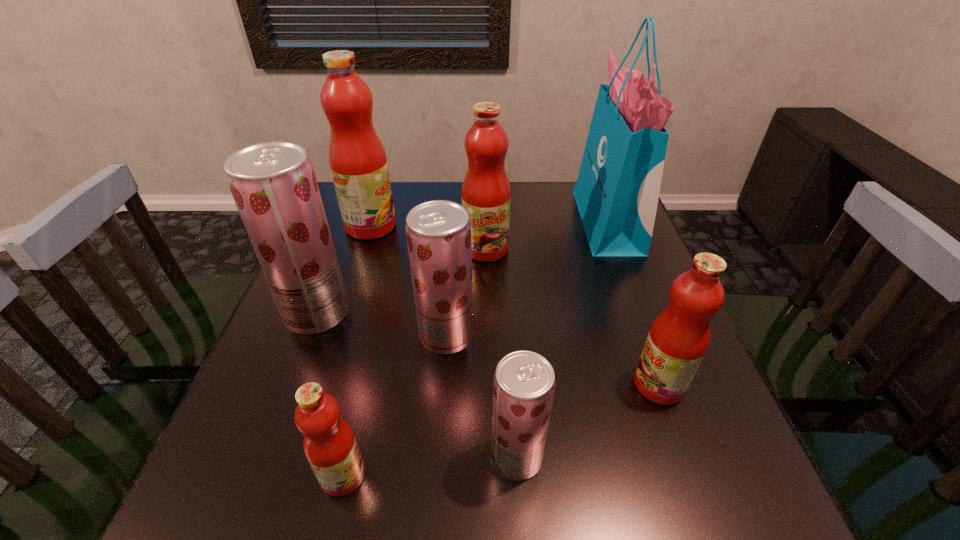
Locate an element on the screen. The width and height of the screenshot is (960, 540). vacant point located between the smallest strawberry fruit juice and the smallest pink fruit juice is located at coordinates (430, 466).

You are a GUI agent. You are given a task and a screenshot of the screen. Output one action in this format:
    pyautogui.click(x=<x>, y=<y>)
    Task: Click on the vacant region between the rightmost pink fruit juice and the blue shopping bag
    The height and width of the screenshot is (540, 960).
    Given the screenshot: What is the action you would take?
    pyautogui.click(x=633, y=303)

Find the location of `vacant area that lies between the leftmost strawberry fruit juice and the second smallest pink fruit juice`. vacant area that lies between the leftmost strawberry fruit juice and the second smallest pink fruit juice is located at coordinates (488, 349).

Where is `free spot between the nearest pink fruit juice and the rightmost strawberry fruit juice`? free spot between the nearest pink fruit juice and the rightmost strawberry fruit juice is located at coordinates (430, 466).

You are a GUI agent. You are given a task and a screenshot of the screen. Output one action in this format:
    pyautogui.click(x=<x>, y=<y>)
    Task: Click on the free space between the second biggest pink fruit juice and the leftmost strawberry fruit juice
    
    Given the screenshot: What is the action you would take?
    [401, 281]

Locate an element on the screen. The image size is (960, 540). free point between the leftmost strawberry fruit juice and the biggest pink fruit juice is located at coordinates (344, 269).

Where is `vacant area that lies between the leftmost strawberry fruit juice and the smallest strawberry fruit juice`? This screenshot has height=540, width=960. vacant area that lies between the leftmost strawberry fruit juice and the smallest strawberry fruit juice is located at coordinates (417, 385).

Where is `vacant region between the second biggest strawberry fruit juice and the nearest pink fruit juice`? The image size is (960, 540). vacant region between the second biggest strawberry fruit juice and the nearest pink fruit juice is located at coordinates (395, 406).

Select which object is the second closest to the blue shopping bag. Please provide its 2D coordinates. Your answer should be formatted as a tuple, i.e. [(x, y)], where the tuple contains the x and y coordinates of a point satisfying the conditions above.

[(679, 337)]

Locate which object is the fifth closest to the nearest pink fruit juice. Please provide its 2D coordinates. Your answer should be formatted as a tuple, i.e. [(x, y)], where the tuple contains the x and y coordinates of a point satisfying the conditions above.

[(486, 193)]